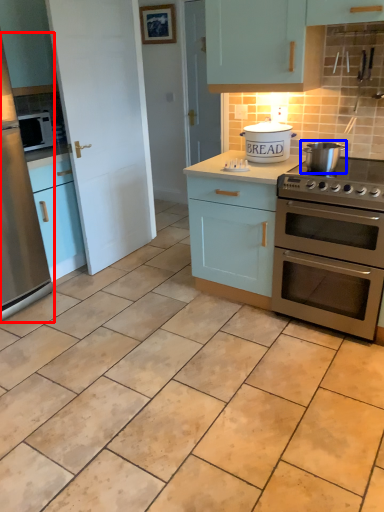
Question: Which of the following is the closest to the observer, fridge (highlighted by a red box) or appliance (highlighted by a blue box)?

Choices:
 (A) fridge
 (B) appliance

Answer: (A)